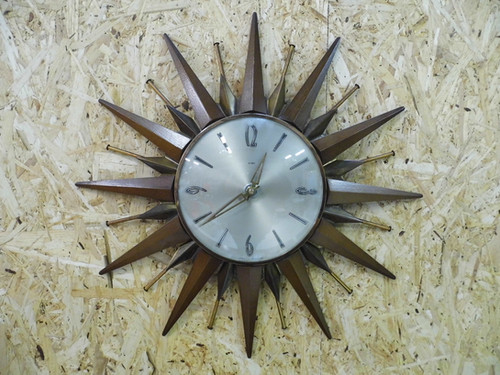
Identify the location of crack in wall. The image size is (500, 375). (331, 25).